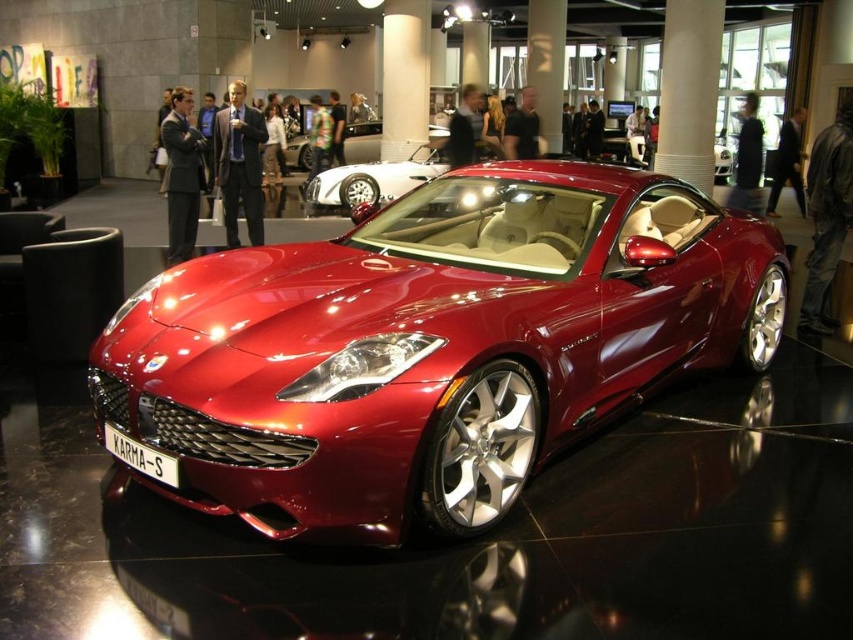
You are standing in an auto show and want to take a photo of the shiny metallic sports car at center. If you are positioned at the entrance of the showroom, which is at the bottom left corner of the image, in which general direction should you point your camera to capture the car?

The shiny metallic sports car at center is located at coordinates approximately halfway between the left and right edges and slightly below the vertical midpoint of the image. Since you are at the bottom left corner, you should aim your camera towards the upper right direction to capture the car.

You are at the auto show and want to take a photo of the shiny metallic sports car at center. If you are standing at the entrance which is at point 0.0, 0.0, in which direction should you move to get closer to the car?

The shiny metallic sports car at center is located at point [428,346], so you should move towards the center of the showroom to get closer to the car.